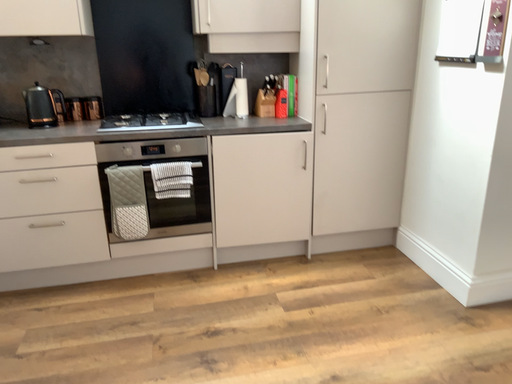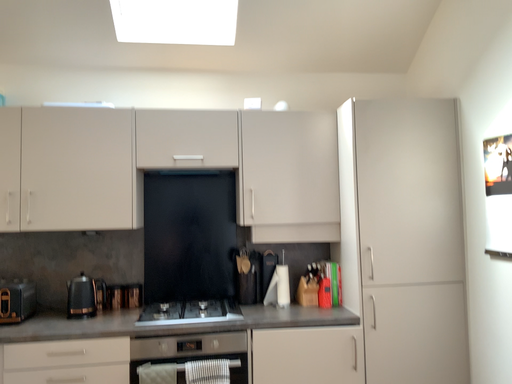
Question: How did the camera likely rotate when shooting the video?

Choices:
 (A) rotated upward
 (B) rotated downward

Answer: (A)